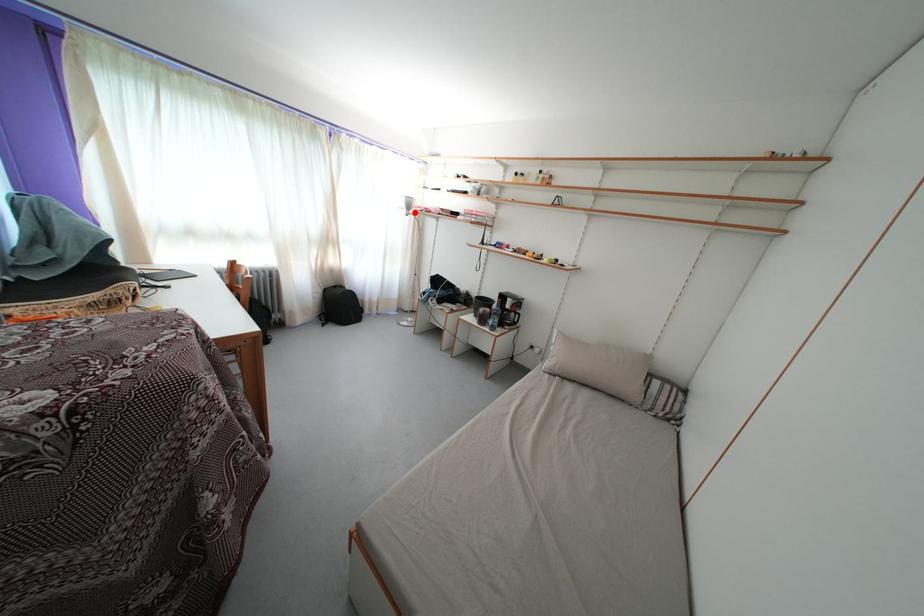
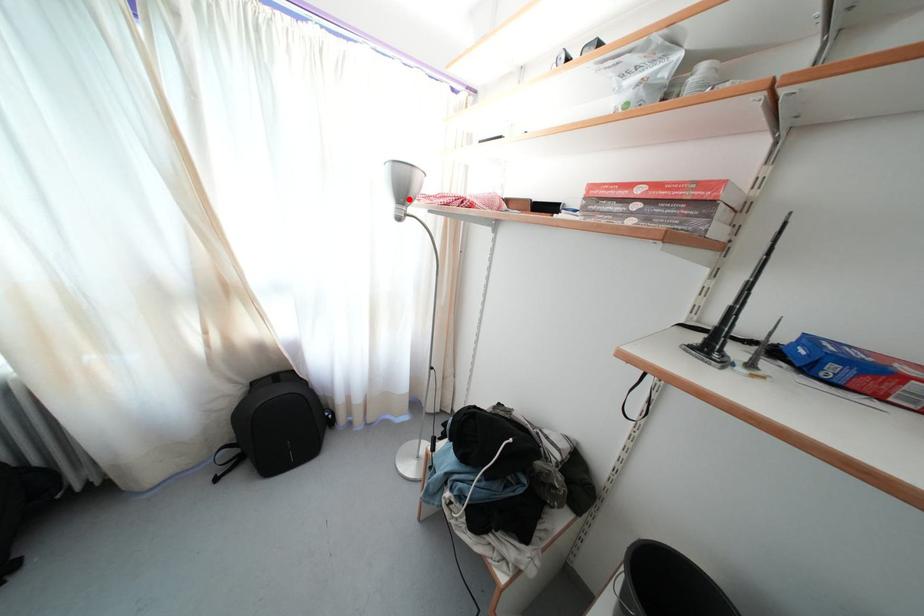
Consider the image. I am providing you with two images of the same scene from different viewpoints. A red point is marked on the first image and another point is marked on the second image. Is the red point in image1 aligned with the point shown in image2?

Yes